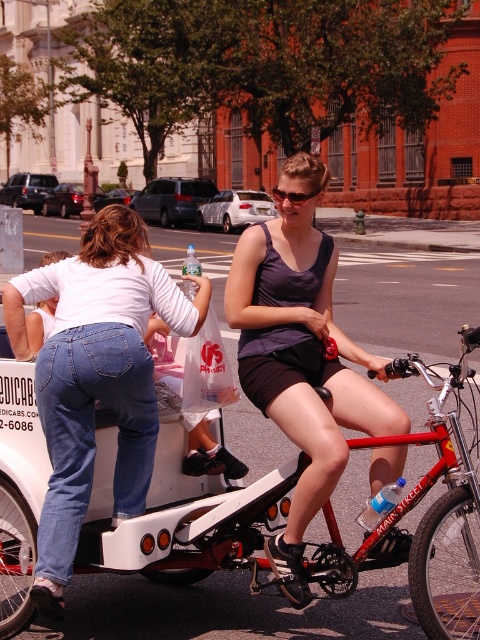
You are standing at the point marked as point (330, 301) in the image, which is 3.58 meters away from you. You want to take a photo of the tandem bicycle taxi. Is the bicycle taxi within your camera lens range if your camera has a maximum focus distance of 3.5 meters?

The distance of point (330, 301) from viewer is 3.58 meters, which is beyond the camera lens range of 3.5 meters. Therefore, the bicycle taxi is out of focus and cannot be captured clearly.

You are a photographer standing on the sidewalk. You want to take a photo of the denim shorts at center and the red matte bicycle at center. Which object will appear larger in your photo?

The red matte bicycle at center will appear larger in the photo because it is larger in size compared to the denim shorts at center.